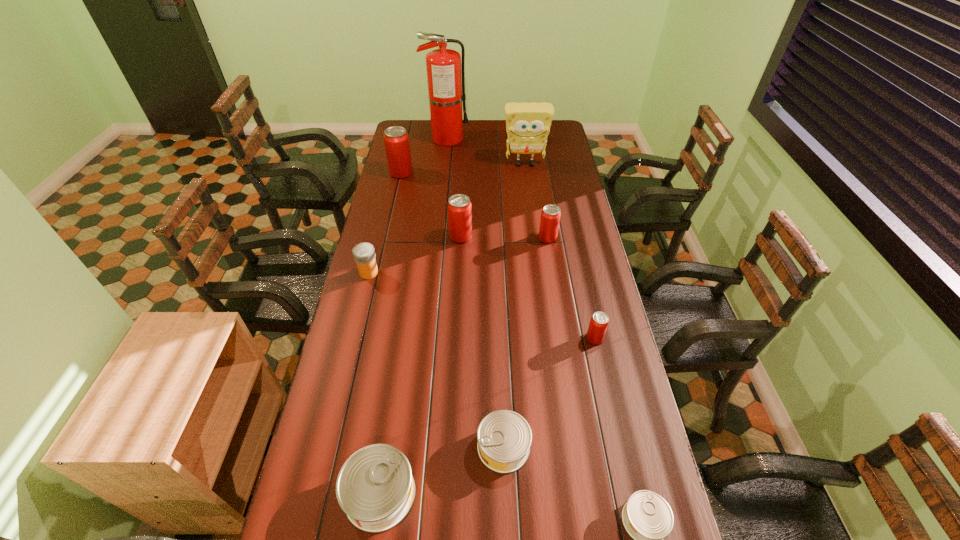
Locate an element on the screen. free space that is in between the ninth tallest object and the fifth can from left to right is located at coordinates (525, 342).

You are a GUI agent. You are given a task and a screenshot of the screen. Output one action in this format:
    pyautogui.click(x=<x>, y=<y>)
    Task: Click on the unoccupied area between the sixth shortest can and the biggest silver can
    
    Given the screenshot: What is the action you would take?
    pyautogui.click(x=420, y=365)

The height and width of the screenshot is (540, 960). I want to click on vacant space in between the fifth shortest can and the sixth farthest object, so click(458, 255).

Where is `free area in between the third can from right to left and the sponge`? free area in between the third can from right to left and the sponge is located at coordinates (537, 201).

I want to click on unoccupied area between the third red can from left to right and the leftmost red can, so click(474, 205).

Identify which object is the closest to the fourth can from left to right. Please provide its 2D coordinates. Your answer should be formatted as a tuple, i.e. [(x, y)], where the tuple contains the x and y coordinates of a point satisfying the conditions above.

[(375, 487)]

Select which object is the seventh closest to the fourth nearest can. Please provide its 2D coordinates. Your answer should be formatted as a tuple, i.e. [(x, y)], where the tuple contains the x and y coordinates of a point satisfying the conditions above.

[(528, 125)]

You are a GUI agent. You are given a task and a screenshot of the screen. Output one action in this format:
    pyautogui.click(x=<x>, y=<y>)
    Task: Click on the can that stands as the closest to the second smallest silver can
    This screenshot has width=960, height=540.
    Given the screenshot: What is the action you would take?
    pyautogui.click(x=375, y=487)

What are the coordinates of `can that is the third closest to the orange medicine` in the screenshot? It's located at 550,217.

Choose which red can is the nearest neighbor to the tallest can. Please provide its 2D coordinates. Your answer should be formatted as a tuple, i.e. [(x, y)], where the tuple contains the x and y coordinates of a point satisfying the conditions above.

[(459, 207)]